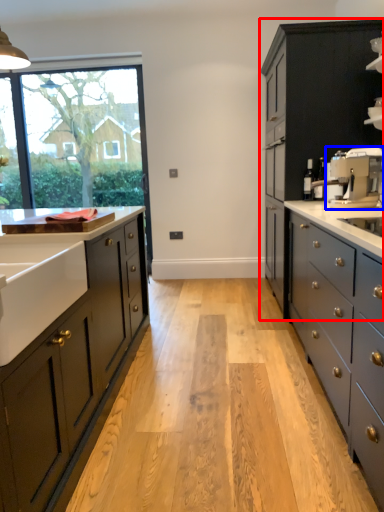
Question: Which of the following is the farthest to the observer, cabinetry (highlighted by a red box) or coffee machine (highlighted by a blue box)?

Choices:
 (A) cabinetry
 (B) coffee machine

Answer: (A)